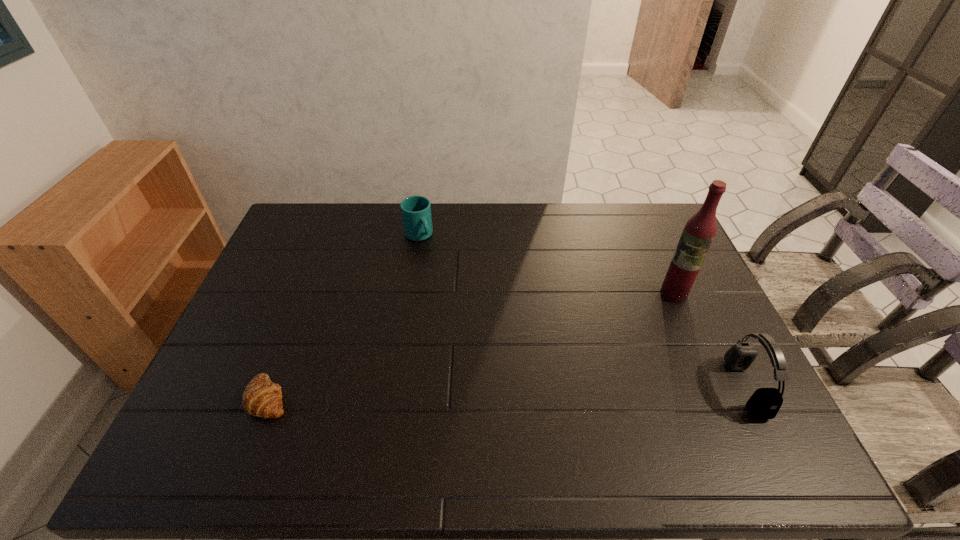
The image size is (960, 540). Identify the location of free space between the liquor and the crescent roll. (471, 346).

The image size is (960, 540). In order to click on the closest object relative to the tallest object in this screenshot , I will do `click(765, 403)`.

Locate an element on the screen. Image resolution: width=960 pixels, height=540 pixels. object that is the second nearest to the liquor is located at coordinates (416, 210).

You are a GUI agent. You are given a task and a screenshot of the screen. Output one action in this format:
    pyautogui.click(x=<x>, y=<y>)
    Task: Click on the blank space that satisfies the following two spatial constraints: 1. on the front side of the third nearest object; 2. on the headband of the rightmost object
    The image size is (960, 540).
    Given the screenshot: What is the action you would take?
    pyautogui.click(x=714, y=388)

Find the location of a particular element. The height and width of the screenshot is (540, 960). free spot that satisfies the following two spatial constraints: 1. on the front side of the second farthest object; 2. on the headband of the headset is located at coordinates (714, 388).

Image resolution: width=960 pixels, height=540 pixels. Identify the location of free space that satisfies the following two spatial constraints: 1. on the front side of the tallest object; 2. on the headband of the second tallest object. (714, 388).

The height and width of the screenshot is (540, 960). I want to click on vacant area in the image that satisfies the following two spatial constraints: 1. on the front side of the rightmost object; 2. on the headband of the third object from right to left, so click(394, 388).

Where is `vacant region that satisfies the following two spatial constraints: 1. on the back side of the shortest object; 2. on the headband of the headset`? vacant region that satisfies the following two spatial constraints: 1. on the back side of the shortest object; 2. on the headband of the headset is located at coordinates (273, 388).

This screenshot has width=960, height=540. I want to click on vacant space that satisfies the following two spatial constraints: 1. on the back side of the second object from left to right; 2. on the right side of the leftmost object, so click(x=331, y=235).